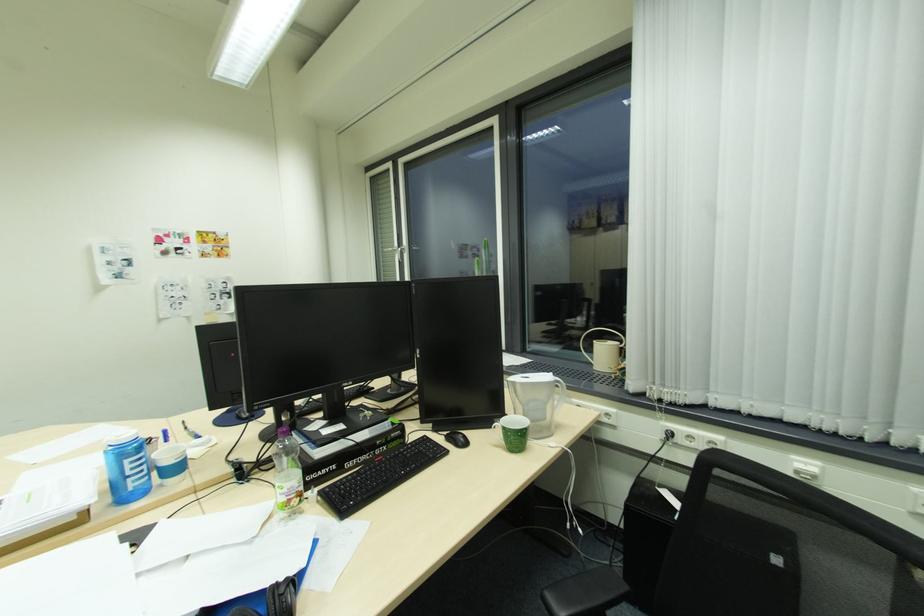
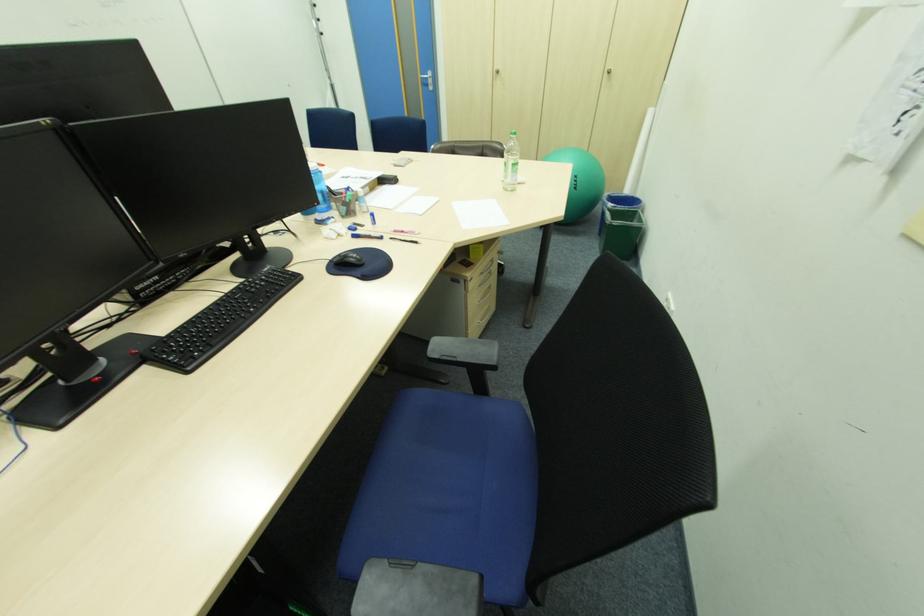
Question: I am providing you with two images of the same scene from different viewpoints. Please identify which objects are invisible in image2.

Choices:
 (A) silver cabinet handle
 (B) blue chair sitting surface
 (C) plastic drink bottle
 (D) textured glass sphere

Answer: (C)